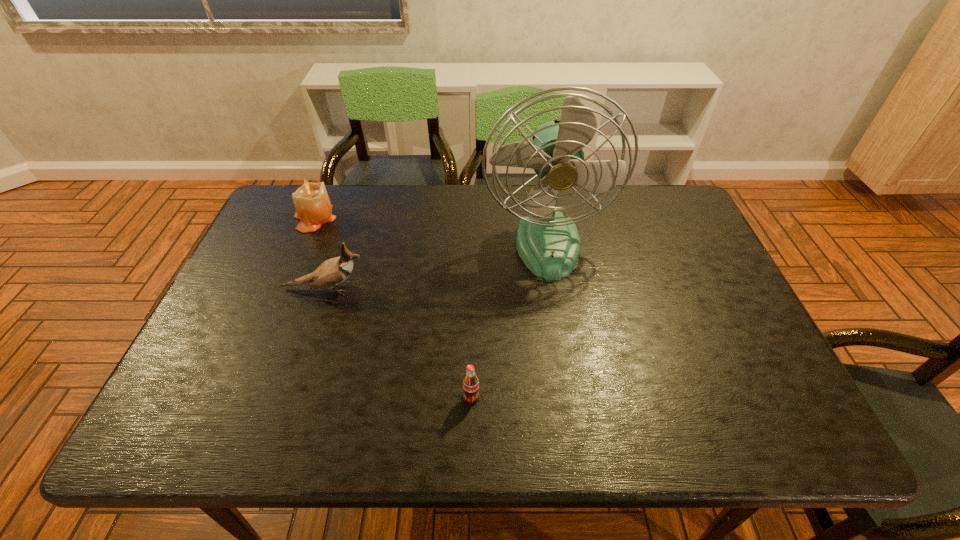
What are the coordinates of `vacant area at the far right corner` in the screenshot? It's located at (683, 224).

Locate an element on the screen. This screenshot has height=540, width=960. free area in between the tallest object and the nearest object is located at coordinates (509, 320).

At what (x,y) coordinates should I click in order to perform the action: click on empty space that is in between the fan and the bird. Please return your answer as a coordinate pair (x, y). The height and width of the screenshot is (540, 960). Looking at the image, I should click on (436, 266).

Identify the location of unoccupied position between the candle and the nearest object. The width and height of the screenshot is (960, 540). (394, 308).

I want to click on unoccupied area between the shortest object and the tallest object, so click(x=509, y=320).

I want to click on empty space that is in between the tallest object and the soda, so click(x=509, y=320).

You are a GUI agent. You are given a task and a screenshot of the screen. Output one action in this format:
    pyautogui.click(x=<x>, y=<y>)
    Task: Click on the free space between the shortest object and the candle
    
    Given the screenshot: What is the action you would take?
    pyautogui.click(x=394, y=308)

The height and width of the screenshot is (540, 960). In order to click on vacant space in between the candle and the bird in this screenshot , I will do `click(320, 253)`.

Find the location of a particular element. Image resolution: width=960 pixels, height=540 pixels. vacant area between the fan and the bird is located at coordinates (436, 266).

This screenshot has width=960, height=540. In order to click on free space between the soda and the rightmost object in this screenshot , I will do `click(509, 320)`.